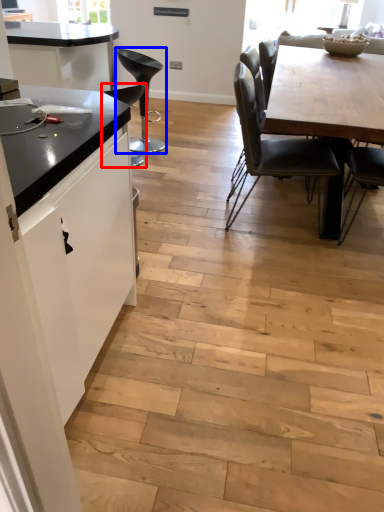
Question: Which object appears closest to the camera in this image, chair (highlighted by a red box) or chair (highlighted by a blue box)?

Choices:
 (A) chair
 (B) chair

Answer: (A)